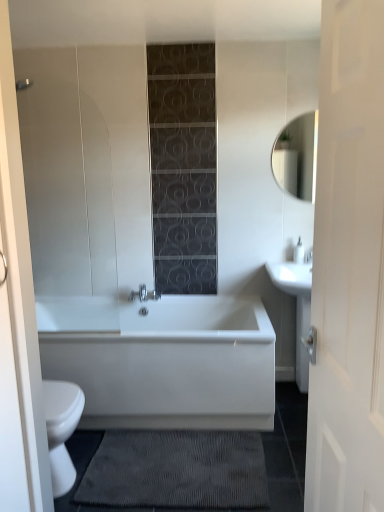
Question: Is matte white mirror at upper right taller than white glossy sink at right?

Choices:
 (A) yes
 (B) no

Answer: (B)

Question: Is matte white mirror at upper right with white glossy sink at right?

Choices:
 (A) no
 (B) yes

Answer: (A)

Question: Does matte white mirror at upper right have a lesser width compared to white glossy sink at right?

Choices:
 (A) no
 (B) yes

Answer: (B)

Question: Can you confirm if matte white mirror at upper right is shorter than white glossy sink at right?

Choices:
 (A) no
 (B) yes

Answer: (B)

Question: From a real-world perspective, is matte white mirror at upper right positioned over white glossy sink at right based on gravity?

Choices:
 (A) yes
 (B) no

Answer: (A)

Question: From the image's perspective, is dark gray textured bath mat at lower center above or below white wood door at right?

Choices:
 (A) below
 (B) above

Answer: (A)

Question: Is point (150, 488) closer or farther from the camera than point (344, 432)?

Choices:
 (A) closer
 (B) farther

Answer: (B)

Question: Is dark gray textured bath mat at lower center spatially inside white wood door at right, or outside of it?

Choices:
 (A) inside
 (B) outside

Answer: (B)

Question: From their relative heights in the image, would you say dark gray textured bath mat at lower center is taller or shorter than white wood door at right?

Choices:
 (A) tall
 (B) short

Answer: (B)

Question: Considering their positions, is dark gray textured bath mat at lower center located in front of or behind white glossy bathtub at center?

Choices:
 (A) front
 (B) behind

Answer: (A)

Question: Based on their sizes in the image, would you say dark gray textured bath mat at lower center is bigger or smaller than white glossy bathtub at center?

Choices:
 (A) big
 (B) small

Answer: (B)

Question: Is dark gray textured bath mat at lower center inside or outside of white glossy bathtub at center?

Choices:
 (A) outside
 (B) inside

Answer: (A)

Question: From a real-world perspective, is dark gray textured bath mat at lower center positioned above or below white glossy bathtub at center?

Choices:
 (A) below
 (B) above

Answer: (A)

Question: Is point (299, 142) closer or farther from the camera than point (244, 337)?

Choices:
 (A) closer
 (B) farther

Answer: (B)

Question: Which is correct: matte white mirror at upper right is inside white glossy bathtub at center, or outside of it?

Choices:
 (A) inside
 (B) outside

Answer: (B)